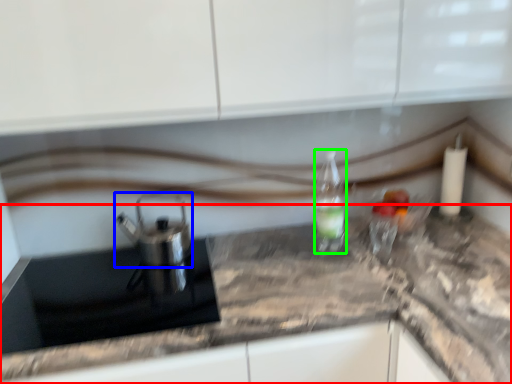
Question: Estimate the real-world distances between objects in this image. Which object is closer to countertop (highlighted by a red box), tea pot (highlighted by a blue box) or bottle (highlighted by a green box)?

Choices:
 (A) tea pot
 (B) bottle

Answer: (B)